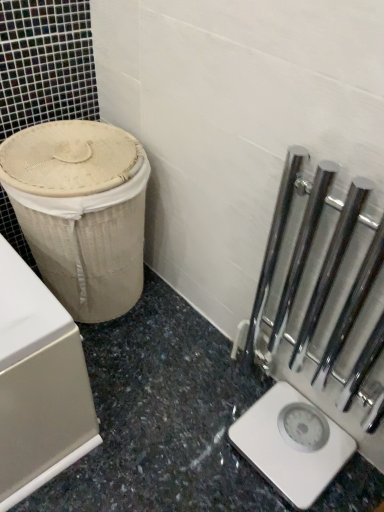
You are a GUI agent. You are given a task and a screenshot of the screen. Output one action in this format:
    pyautogui.click(x=<x>, y=<y>)
    Task: Click on the beige woven basket at left
    
    Given the screenshot: What is the action you would take?
    pyautogui.click(x=81, y=212)

Where is `white plastic scale at lower right`? This screenshot has height=512, width=384. white plastic scale at lower right is located at coordinates (292, 444).

From the image's perspective, who appears lower, beige woven basket at left or white plastic scale at lower right?

white plastic scale at lower right appears lower in the image.

Is beige woven basket at left far away from white plastic scale at lower right?

No, beige woven basket at left is not far from white plastic scale at lower right.

Who is taller, beige woven basket at left or white plastic scale at lower right?

Standing taller between the two is beige woven basket at left.

Relative to white plastic scale at lower right, is beige woven basket at left in front or behind?

In the image, beige woven basket at left appears in front of white plastic scale at lower right.

The width and height of the screenshot is (384, 512). In order to click on waste container behind the polished chrome rail at right in this screenshot , I will do `click(81, 212)`.

Measure the distance from beige woven basket at left to polished chrome rail at right.

A distance of 56.62 centimeters exists between beige woven basket at left and polished chrome rail at right.

Considering the sizes of objects beige woven basket at left and polished chrome rail at right in the image provided, who is taller, beige woven basket at left or polished chrome rail at right?

polished chrome rail at right is taller.

From the image's perspective, which one is positioned higher, beige woven basket at left or polished chrome rail at right?

From the image's view, beige woven basket at left is above.

Where is `scale that appears below the polished chrome rail at right (from a real-world perspective)`? scale that appears below the polished chrome rail at right (from a real-world perspective) is located at coordinates (292, 444).

From the image's perspective, which is above, polished chrome rail at right or white plastic scale at lower right?

polished chrome rail at right is shown above in the image.

Is polished chrome rail at right directly adjacent to white plastic scale at lower right?

No, polished chrome rail at right is not next to white plastic scale at lower right.

Can you confirm if polished chrome rail at right is smaller than white plastic scale at lower right?

Incorrect, polished chrome rail at right is not smaller in size than white plastic scale at lower right.

Which object is more forward, white plastic scale at lower right or polished chrome rail at right?

polished chrome rail at right.

Does white plastic scale at lower right have a greater width compared to polished chrome rail at right?

Yes.

Consider the image. Between white plastic scale at lower right and polished chrome rail at right, which one appears on the right side from the viewer's perspective?

From the viewer's perspective, polished chrome rail at right appears more on the right side.

From a real-world perspective, is white plastic scale at lower right beneath polished chrome rail at right?

Yes, from a real-world perspective, white plastic scale at lower right is beneath polished chrome rail at right.

From a real-world perspective, is polished chrome rail at right over beige woven basket at left?

Yes, from a real-world perspective, polished chrome rail at right is over beige woven basket at left

Measure the distance from polished chrome rail at right to beige woven basket at left.

They are 22.29 inches apart.

Is polished chrome rail at right in front of or behind beige woven basket at left in the image?

Visually, polished chrome rail at right is located in front of beige woven basket at left.

Is polished chrome rail at right located outside beige woven basket at left?

Absolutely, polished chrome rail at right is external to beige woven basket at left.

Considering the positions of objects white plastic scale at lower right and beige woven basket at left in the image provided, who is more to the left, white plastic scale at lower right or beige woven basket at left?

beige woven basket at left.

From the image's perspective, relative to beige woven basket at left, is white plastic scale at lower right above or below?

white plastic scale at lower right is situated lower than beige woven basket at left in the image.

Consider the image. Are white plastic scale at lower right and beige woven basket at left located far from each other?

That's not correct — white plastic scale at lower right is a little close to beige woven basket at left.

I want to click on scale that is behind the beige woven basket at left, so click(x=292, y=444).

Locate an element on the screen. Image resolution: width=384 pixels, height=512 pixels. waste container that appears above the polished chrome rail at right (from the image's perspective) is located at coordinates (81, 212).

From the image, which object appears to be farther from beige woven basket at left, polished chrome rail at right or white plastic scale at lower right?

Among the two, white plastic scale at lower right is located further to beige woven basket at left.

Based on their spatial positions, is beige woven basket at left or polished chrome rail at right further from white plastic scale at lower right?

beige woven basket at left is further to white plastic scale at lower right.

In the scene shown: From the image, which object appears to be nearer to beige woven basket at left, white plastic scale at lower right or polished chrome rail at right?

Among the two, polished chrome rail at right is located nearer to beige woven basket at left.

When comparing their distances from polished chrome rail at right, does beige woven basket at left or white plastic scale at lower right seem closer?

white plastic scale at lower right is closer to polished chrome rail at right.

When comparing their distances from white plastic scale at lower right, does polished chrome rail at right or beige woven basket at left seem closer?

Among the two, polished chrome rail at right is located nearer to white plastic scale at lower right.

From the image, which object appears to be nearer to polished chrome rail at right, white plastic scale at lower right or beige woven basket at left?

The object closer to polished chrome rail at right is white plastic scale at lower right.

What are the coordinates of `scale situated between beige woven basket at left and polished chrome rail at right from left to right` in the screenshot? It's located at (292, 444).